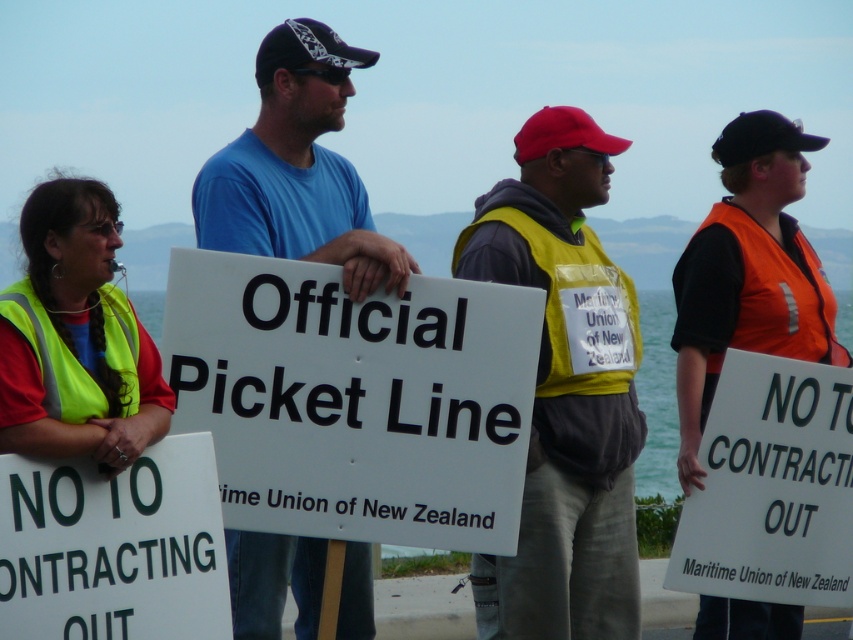
Does white paper sign at center appear under white paper sign at right?

Incorrect, white paper sign at center is not positioned below white paper sign at right.

Between point (7, 515) and point (755, 548), which one is positioned behind?

Positioned behind is point (755, 548).

Between point (38, 589) and point (840, 497), which one is positioned behind?

Point (840, 497)

This screenshot has width=853, height=640. Find the location of `white paper sign at center`. white paper sign at center is located at coordinates [113, 547].

Is point (311, 509) behind point (593, 339)?

That is False.

Looking at this image, is white plastic sign at center taller than yellow reflective safety vest at center?

Correct, white plastic sign at center is much taller as yellow reflective safety vest at center.

The width and height of the screenshot is (853, 640). What are the coordinates of `white plastic sign at center` in the screenshot? It's located at (355, 400).

Between point (28, 481) and point (712, 321), which one is positioned in front?

Point (28, 481)

The image size is (853, 640). In order to click on white paper sign at center in this screenshot , I will do `click(113, 547)`.